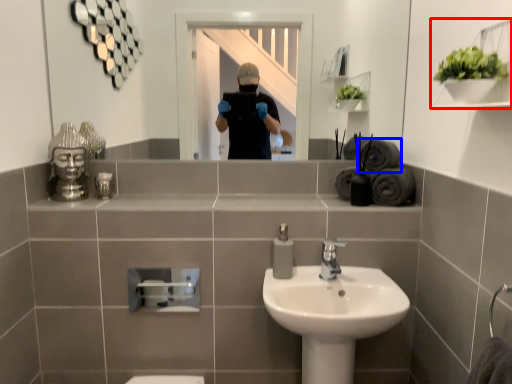
Question: Which point is further to the camera, shelf (highlighted by a red box) or bath towel (highlighted by a blue box)?

Choices:
 (A) shelf
 (B) bath towel

Answer: (B)